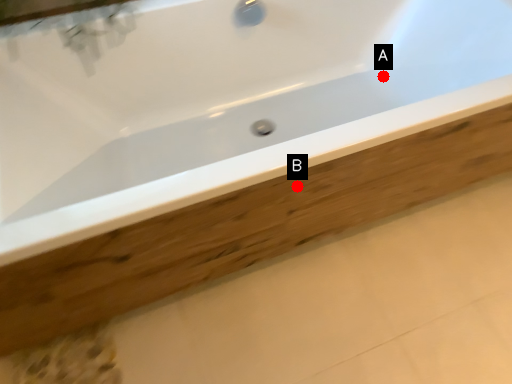
Question: Two points are circled on the image, labeled by A and B beside each circle. Among these points, which one is nearest to the camera?

Choices:
 (A) A is closer
 (B) B is closer

Answer: (B)